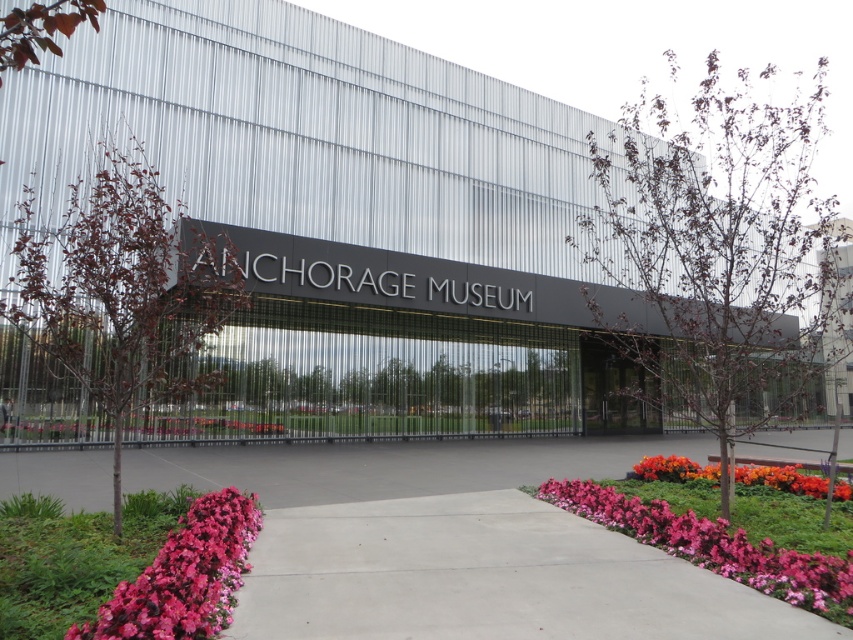
Question: Considering the real-world distances, which object is closest to the pink matte flowers at lower right?

Choices:
 (A) black glass doors at center
 (B) concrete at center
 (C) orange matte flower at lower right

Answer: (C)

Question: Which of these objects is positioned farthest from the pink matte flowers at lower right?

Choices:
 (A) orange matte flower at lower right
 (B) concrete at center

Answer: (B)

Question: From the image, what is the correct spatial relationship of black glass doors at center in relation to orange matte flower at lower right?

Choices:
 (A) right
 (B) left

Answer: (A)

Question: Can you confirm if concrete at center is smaller than pink matte flowers at lower right?

Choices:
 (A) no
 (B) yes

Answer: (A)

Question: Which object is positioned closest to the pink matte flowers at lower right?

Choices:
 (A) black glass doors at center
 (B) orange matte flower at lower right
 (C) concrete at center
 (D) pink matte flowers at lower left

Answer: (B)

Question: Does pink matte flowers at lower right come in front of black glass doors at center?

Choices:
 (A) yes
 (B) no

Answer: (A)